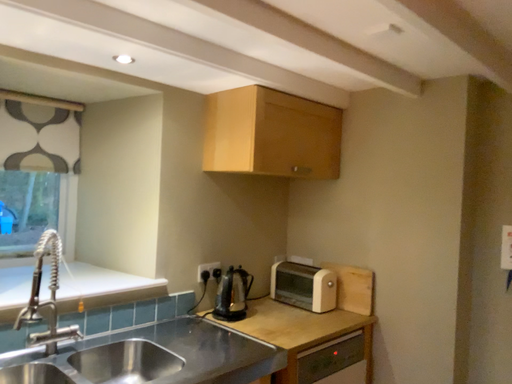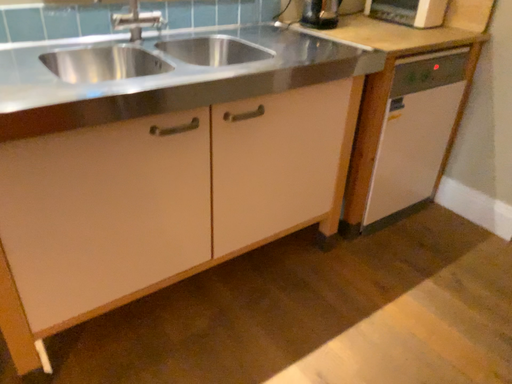
Question: Which way did the camera rotate in the video?

Choices:
 (A) rotated downward
 (B) rotated upward

Answer: (A)